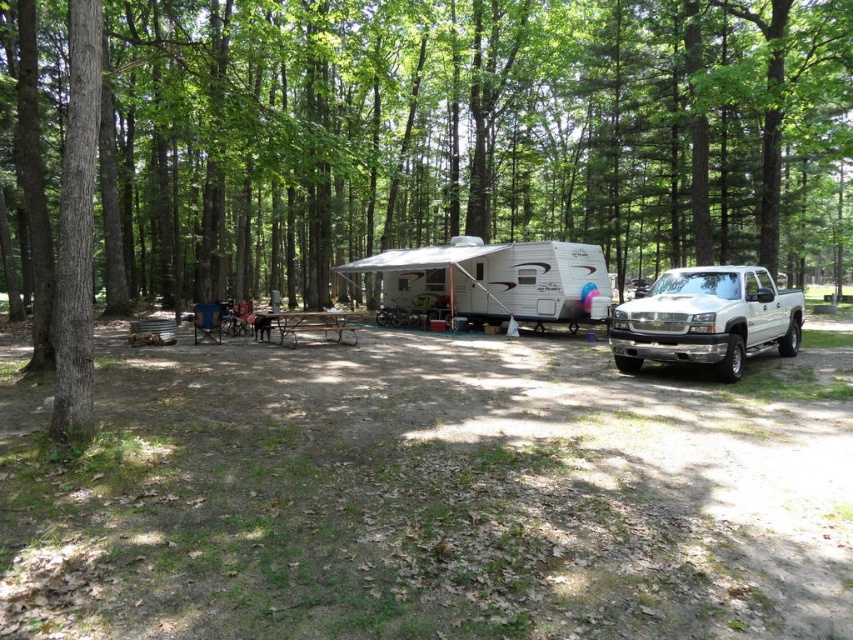
You are planning to move the white glossy pickup truck at right and the brown metal picnic table at center to a different location. Which object would require more space when moving?

The brown metal picnic table at center requires more space when moving because the white glossy pickup truck at right occupies less space than it.

You are a hiker trying to set up a tent between the brown textured tree at center and the white glossy pickup truck at right. Which object should you place your tent closer to if you want it to be sheltered from the wind coming from the right side of the scene?

You should place your tent closer to the brown textured tree at center because it is closer to the viewer and can provide a windbreak against the wind coming from the right side of the scene.